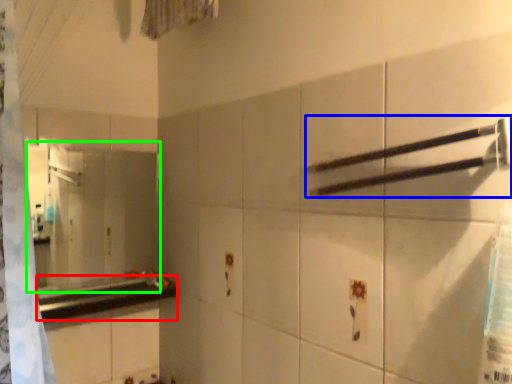
Question: Which is nearer to the counter top (highlighted by a red box)? towel bar (highlighted by a blue box) or mirror (highlighted by a green box).

Choices:
 (A) towel bar
 (B) mirror

Answer: (B)